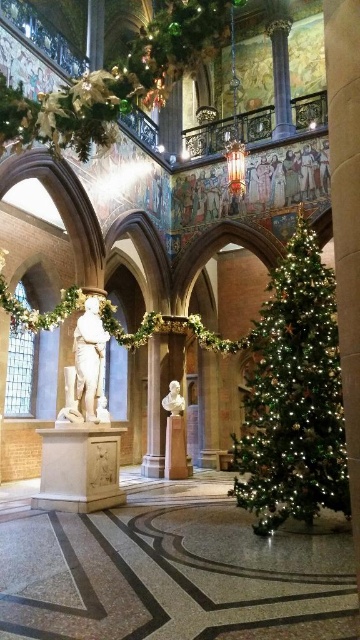
Is white marble statue at center positioned at the back of white marble bust at center?

No, white marble statue at center is closer to the viewer.

Does white marble statue at center have a larger size compared to white marble bust at center?

Indeed, white marble statue at center has a larger size compared to white marble bust at center.

Is point (90, 346) positioned after point (168, 390)?

No, it is not.

At what (x,y) coordinates should I click in order to perform the action: click on white marble statue at center. Please return your answer as a coordinate pair (x, y). The width and height of the screenshot is (360, 640). Looking at the image, I should click on pos(87,369).

Who is more distant from viewer, (x=257, y=324) or (x=96, y=298)?

Positioned behind is point (x=96, y=298).

Who is higher up, green matte christmas tree at right or white marble statue at center?

green matte christmas tree at right is above.

Is point (330, 358) closer to viewer compared to point (82, 419)?

Yes, it is in front of point (82, 419).

Locate an element on the screen. This screenshot has height=640, width=360. green matte christmas tree at right is located at coordinates (294, 396).

Can you confirm if green leafy garland at upper center is wider than white marble statue at center?

Indeed, green leafy garland at upper center has a greater width compared to white marble statue at center.

Can you confirm if green leafy garland at upper center is positioned to the right of white marble statue at center?

Indeed, green leafy garland at upper center is positioned on the right side of white marble statue at center.

Locate an element on the screen. Image resolution: width=360 pixels, height=640 pixels. green leafy garland at upper center is located at coordinates (117, 81).